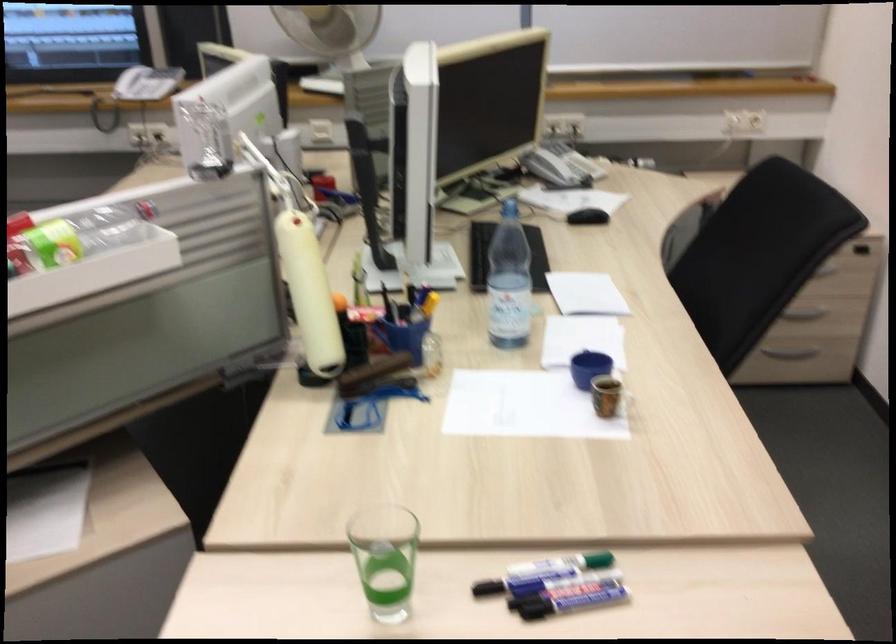
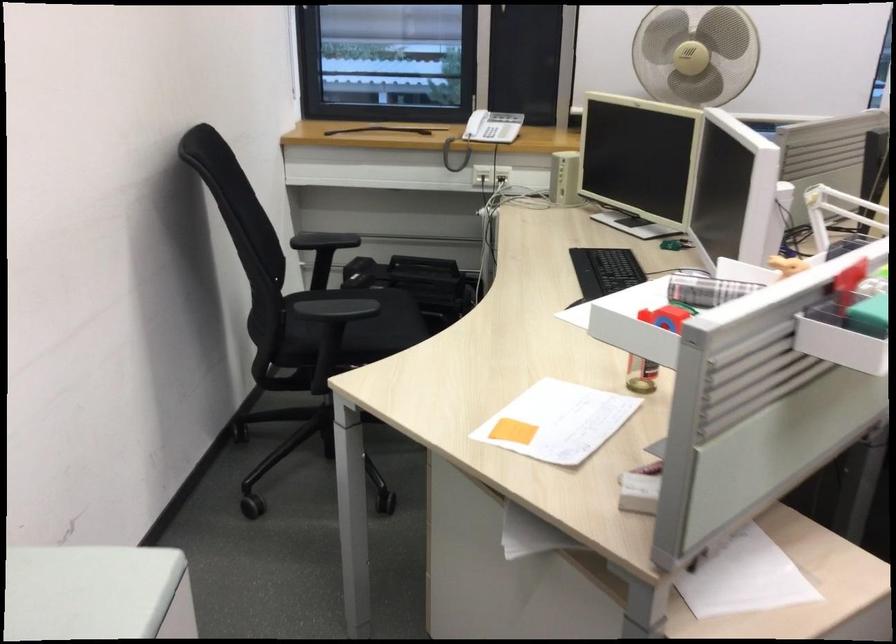
Question: In a continuous first-person perspective shot, in which direction is the camera moving?

Choices:
 (A) Left
 (B) Right
 (C) Forward
 (D) Backward

Answer: (A)